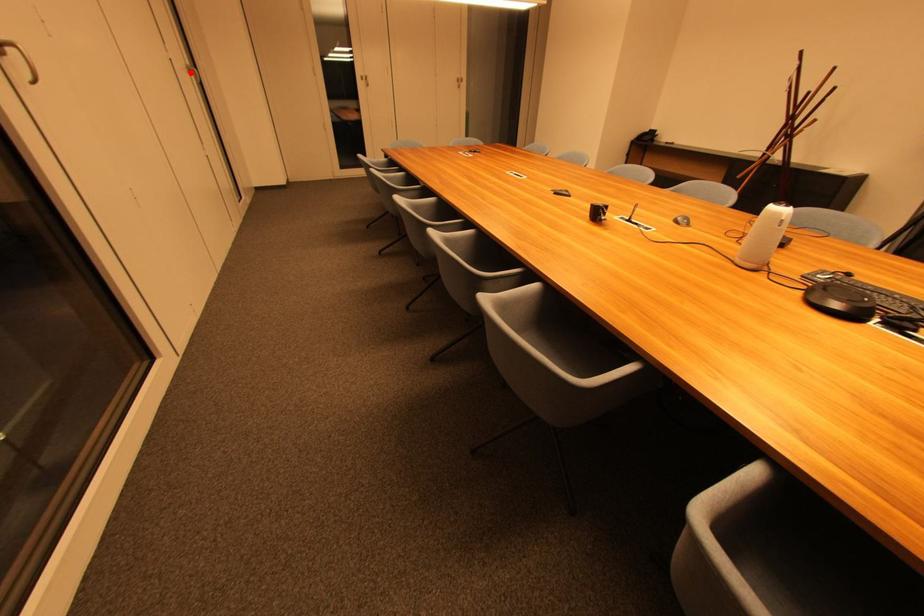
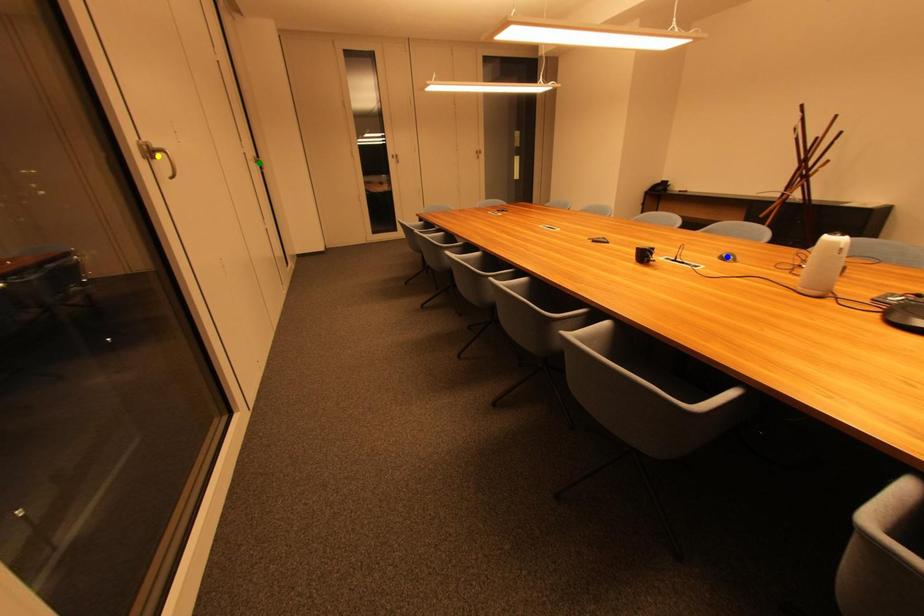
Question: I am providing you with two images of the same scene from different viewpoints. A red point is marked on the first image. You are given multiple points on the second image. Which mark in image 2 goes with the point in image 1?

Choices:
 (A) green point
 (B) blue point
 (C) yellow point

Answer: (A)